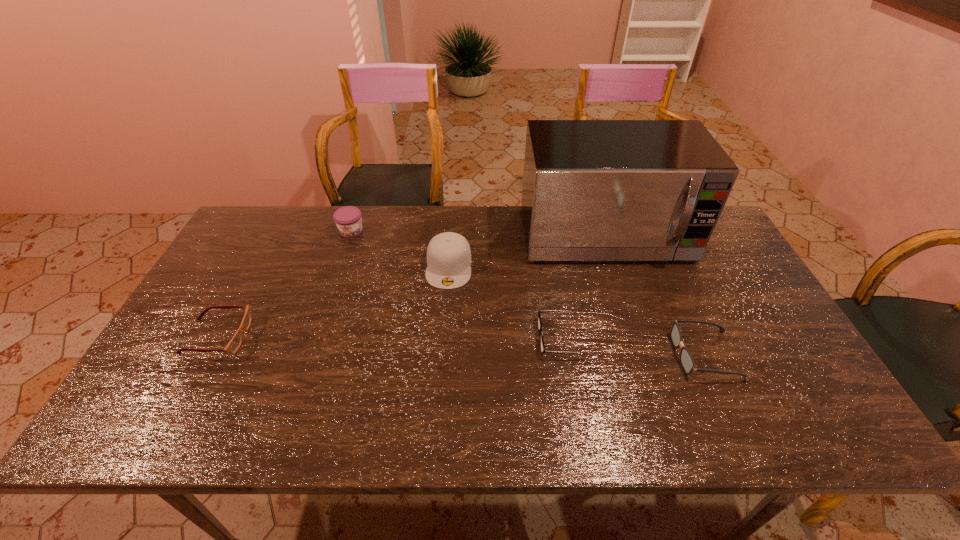
This screenshot has height=540, width=960. I want to click on object that stands as the fifth closest to the rightmost spectacles, so coord(234,344).

Locate an element on the screen. spectacles that can be found as the second closest to the jam is located at coordinates (542, 347).

Locate which spectacles is the third closest to the tallest object. Please provide its 2D coordinates. Your answer should be formatted as a tuple, i.e. [(x, y)], where the tuple contains the x and y coordinates of a point satisfying the conditions above.

[(234, 344)]

This screenshot has width=960, height=540. I want to click on vacant space that satisfies the following two spatial constraints: 1. with the door open on the tallest object; 2. on the front-facing side of the leftmost object, so click(x=637, y=336).

What are the coordinates of `vacant space that satisfies the following two spatial constraints: 1. with the door open on the microwave oven; 2. on the front-facing side of the leftmost spectacles` in the screenshot? It's located at (637, 336).

Identify the location of free spot that satisfies the following two spatial constraints: 1. with the door open on the microwave oven; 2. on the front-facing side of the second shortest spectacles. This screenshot has height=540, width=960. (637, 336).

Where is `blank area in the image that satisfies the following two spatial constraints: 1. with the door open on the microwave oven; 2. on the front-facing side of the second shortest object`? The height and width of the screenshot is (540, 960). blank area in the image that satisfies the following two spatial constraints: 1. with the door open on the microwave oven; 2. on the front-facing side of the second shortest object is located at coordinates (637, 336).

Where is `free point that satisfies the following two spatial constraints: 1. with the door open on the microwave oven; 2. on the front-facing side of the shortest object`? This screenshot has height=540, width=960. free point that satisfies the following two spatial constraints: 1. with the door open on the microwave oven; 2. on the front-facing side of the shortest object is located at coordinates (637, 338).